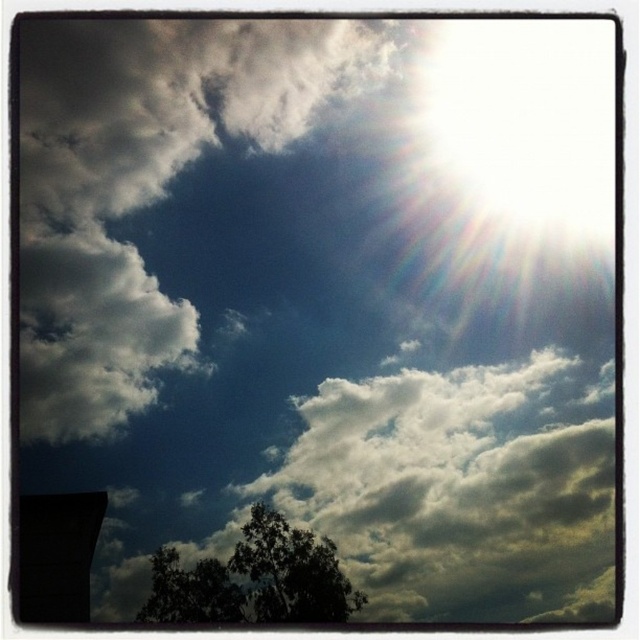
Question: Which object is the closest to the dark green leafy tree at lower left?

Choices:
 (A) white fluffy cloud at upper left
 (B) white fluffy cloud at center

Answer: (B)

Question: Which is nearer to the dark green leafy tree at lower center?

Choices:
 (A) white fluffy cloud at center
 (B) dark green leafy tree at lower left
 (C) white fluffy cloud at upper left

Answer: (B)

Question: Does white fluffy cloud at upper left have a lesser width compared to dark green leafy tree at lower left?

Choices:
 (A) yes
 (B) no

Answer: (B)

Question: Which point is farther to the camera?

Choices:
 (A) (200, 600)
 (B) (451, 602)
 (C) (340, 595)

Answer: (B)

Question: Can you confirm if white fluffy cloud at upper left is thinner than dark green leafy tree at lower center?

Choices:
 (A) yes
 (B) no

Answer: (B)

Question: Can you confirm if white fluffy cloud at center is wider than dark green leafy tree at lower left?

Choices:
 (A) yes
 (B) no

Answer: (A)